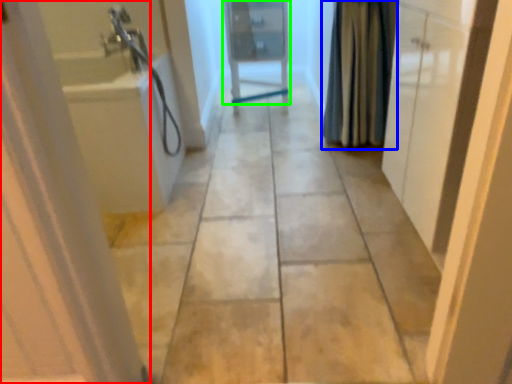
Question: Which object is the closest to the door (highlighted by a red box)? Choose among these: shower curtain (highlighted by a blue box) or door (highlighted by a green box).

Choices:
 (A) shower curtain
 (B) door

Answer: (A)